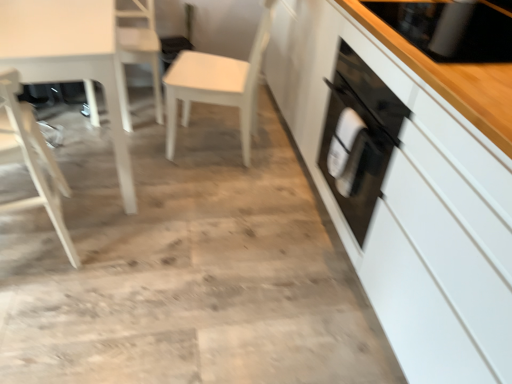
Question: Is white glossy table at left positioned far away from black glass stove at upper right?

Choices:
 (A) no
 (B) yes

Answer: (B)

Question: Could black glass stove at upper right be considered to be inside white glossy table at left?

Choices:
 (A) no
 (B) yes

Answer: (A)

Question: Can you confirm if white glossy table at left is positioned to the left of black glass stove at upper right?

Choices:
 (A) yes
 (B) no

Answer: (A)

Question: Can you confirm if white glossy table at left is taller than black glass stove at upper right?

Choices:
 (A) no
 (B) yes

Answer: (B)

Question: Is white glossy table at left to the right of black glass stove at upper right from the viewer's perspective?

Choices:
 (A) yes
 (B) no

Answer: (B)

Question: Is white glossy table at left aimed at black glass stove at upper right?

Choices:
 (A) yes
 (B) no

Answer: (B)

Question: Is white glossy table at left oriented towards white wood chair at upper left, the 2th chair when ordered from left to right?

Choices:
 (A) no
 (B) yes

Answer: (A)

Question: From a real-world perspective, is white glossy table at left located higher than white wood chair at upper left, the 2th chair when ordered from left to right?

Choices:
 (A) yes
 (B) no

Answer: (A)

Question: Is white glossy table at left oriented away from white wood chair at upper left, positioned as the 2th chair in right-to-left order?

Choices:
 (A) yes
 (B) no

Answer: (A)

Question: Does white glossy table at left come behind white wood chair at upper left, the 2th chair when ordered from left to right?

Choices:
 (A) yes
 (B) no

Answer: (B)

Question: Is white glossy table at left far away from white wood chair at upper left, the 2th chair when ordered from left to right?

Choices:
 (A) yes
 (B) no

Answer: (B)

Question: From the image's perspective, does white glossy table at left appear lower than white wood chair at upper left, the 2th chair when ordered from left to right?

Choices:
 (A) no
 (B) yes

Answer: (B)

Question: Can you confirm if white glossy table at left is smaller than white glossy cabinet at right?

Choices:
 (A) no
 (B) yes

Answer: (B)